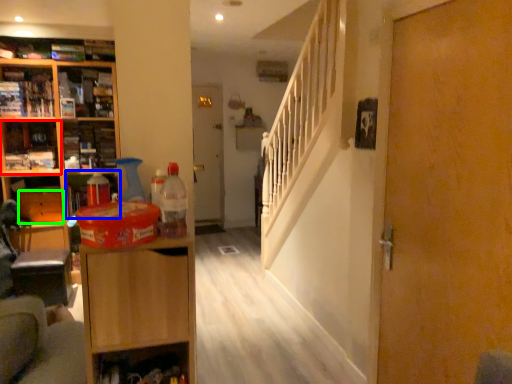
Question: Which object is the closest to the cabinet (highlighted by a red box)? Choose among these: cabinet (highlighted by a blue box) or drawer (highlighted by a green box).

Choices:
 (A) cabinet
 (B) drawer

Answer: (B)